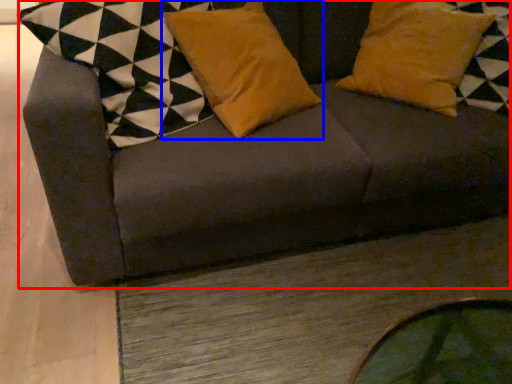
Question: Among these objects, which one is farthest to the camera, studio couch (highlighted by a red box) or pillow (highlighted by a blue box)?

Choices:
 (A) studio couch
 (B) pillow

Answer: (B)